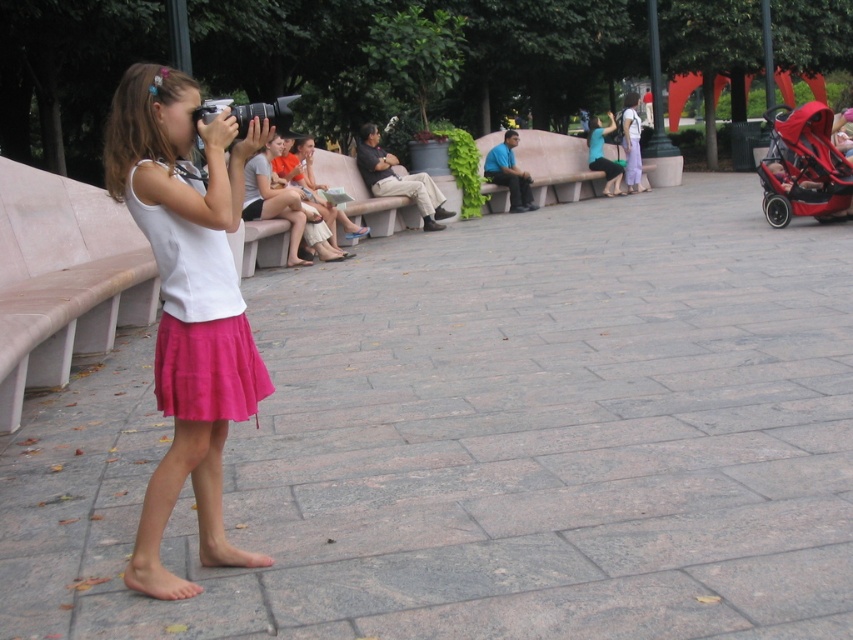
Does red matte baby carriage at right have a larger size compared to matte teal blouse at center?

Yes, red matte baby carriage at right is bigger than matte teal blouse at center.

Locate an element on the screen. red matte baby carriage at right is located at coordinates (804, 168).

Can you confirm if dark gray shirt at center is positioned to the left of purple cotton dress at center?

Correct, you'll find dark gray shirt at center to the left of purple cotton dress at center.

Which is above, dark gray shirt at center or purple cotton dress at center?

purple cotton dress at center is above.

Describe the element at coordinates (398, 179) in the screenshot. The image size is (853, 640). I see `dark gray shirt at center` at that location.

At what (x,y) coordinates should I click in order to perform the action: click on dark gray shirt at center. Please return your answer as a coordinate pair (x, y). Image resolution: width=853 pixels, height=640 pixels. Looking at the image, I should click on (398, 179).

At what (x,y) coordinates should I click in order to perform the action: click on pink satin skirt at left. Please return your answer as a coordinate pair (x, y). Looking at the image, I should click on (199, 321).

Is point (167, 314) more distant than point (613, 128)?

No, (167, 314) is in front of (613, 128).

Identify the location of pink satin skirt at left. (199, 321).